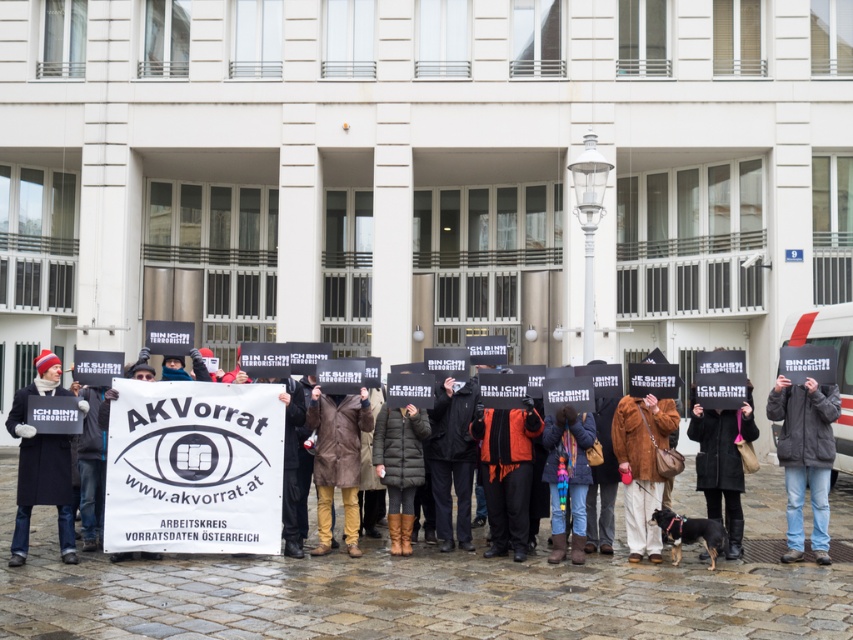
Question: Is the position of dark gray fleece jacket at center less distant than that of dark brown leather coat at center?

Choices:
 (A) yes
 (B) no

Answer: (A)

Question: Which is nearer to the black matte coat at center?

Choices:
 (A) dark gray fleece jacket at center
 (B) brown furry coat at lower right
 (C) brown leather coat at center

Answer: (C)

Question: Which object is the closest to the orange fabric jacket at center?

Choices:
 (A) black matte coat at left
 (B) brown furry coat at lower right
 (C) dark gray fleece jacket at center

Answer: (B)

Question: Estimate the real-world distances between objects in this image. Which object is closer to the multicolored knitted scarf at center?

Choices:
 (A) brown furry coat at lower right
 (B) black matte coat at left

Answer: (A)

Question: Can you confirm if black matte coat at center is positioned below dark brown leather coat at center?

Choices:
 (A) no
 (B) yes

Answer: (A)

Question: Can you confirm if orange fabric jacket at center is thinner than dark brown leather coat at center?

Choices:
 (A) yes
 (B) no

Answer: (B)